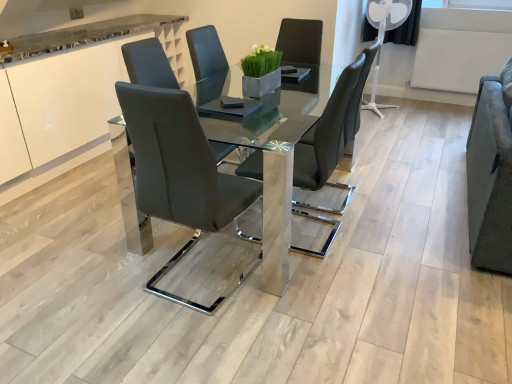
In order to click on blank area to the left of matte black chair at center, the 2th chair viewed from the right in this screenshot , I will do `click(98, 281)`.